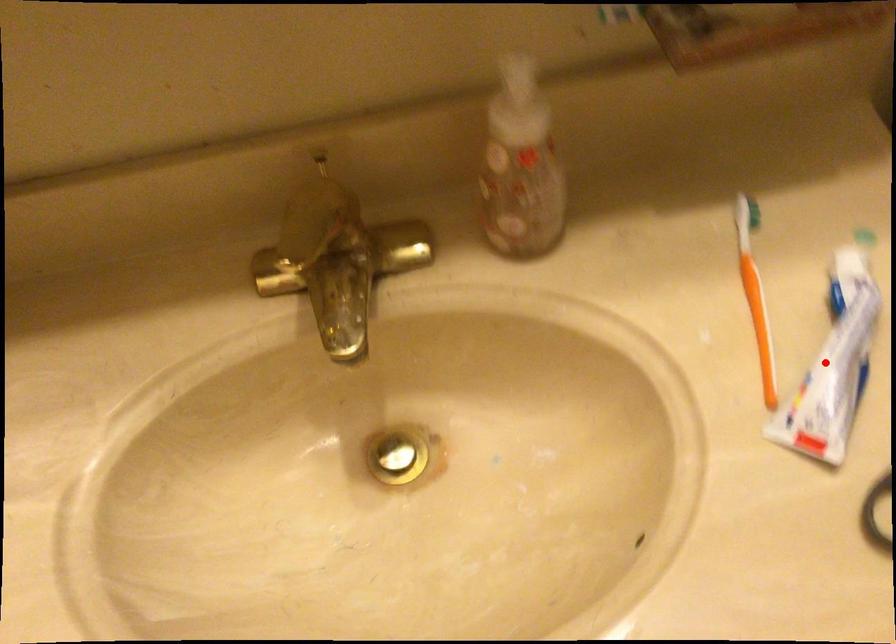
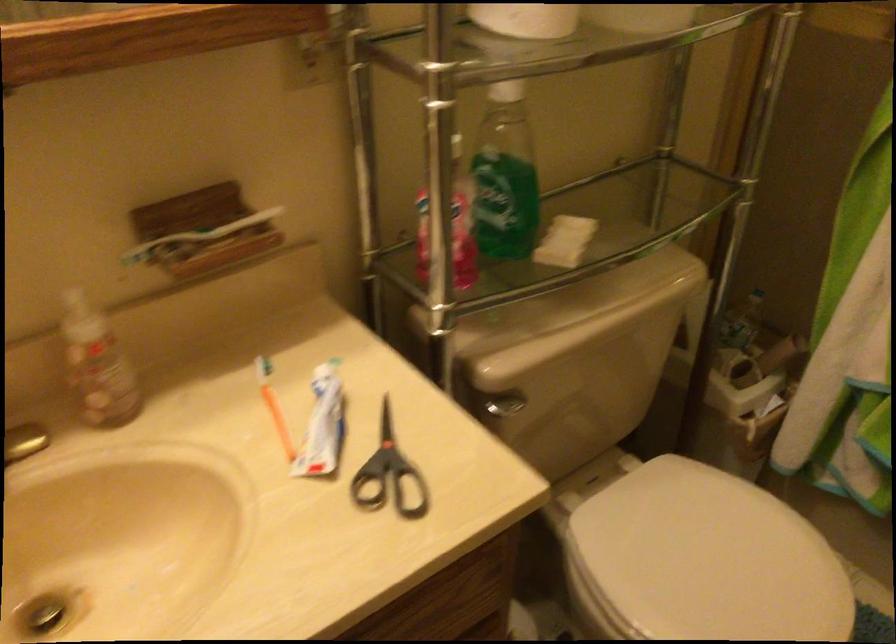
In the second image, find the point that corresponds to the highlighted location in the first image.

(323, 424)